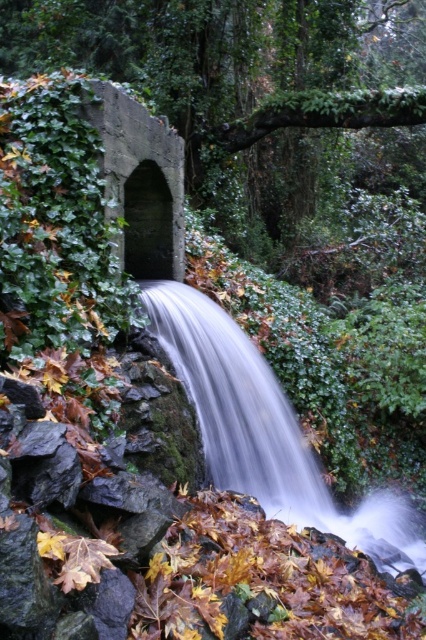
Is point (281, 132) farther from camera compared to point (379, 515)?

Yes, point (281, 132) is farther from viewer.

Is green ivy-covered stone arch at center above white smooth waterfall at center?

Correct, green ivy-covered stone arch at center is located above white smooth waterfall at center.

Is point (406, 188) positioned after point (239, 396)?

Yes, it is.

Identify the location of green ivy-covered stone arch at center. The width and height of the screenshot is (426, 640). (244, 92).